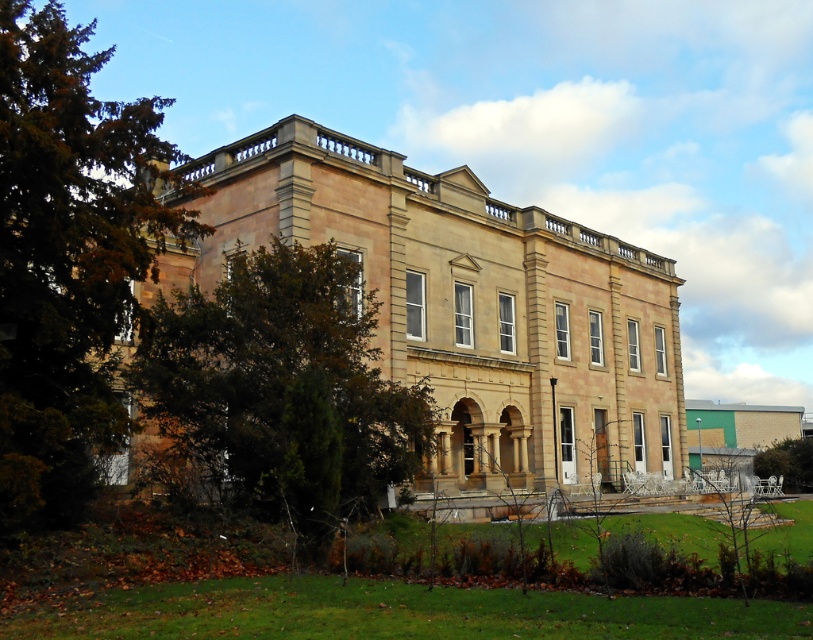
You are standing on the lawn in front of the beige stone palace at center. If you walk directly towards the palace, which direction should you face?

Since the beige stone palace at center is located at point (467, 307) in the 2D space, you should face north to walk directly towards it.

You are a landscape architect designing a garden path between the brown wood tree at left and the green leafy tree at left. Which tree requires more space on the path due to its wider base?

The brown wood tree at left requires more space on the path because its width surpasses that of the green leafy tree at left.

You are standing in a park and see the beige stone palace at center. If you want to take a photo of it from a distance of 50 meters, should you move closer or farther away?

The beige stone palace at center is currently 45.27 meters away. To achieve a distance of 50 meters, you need to move farther away from the palace.